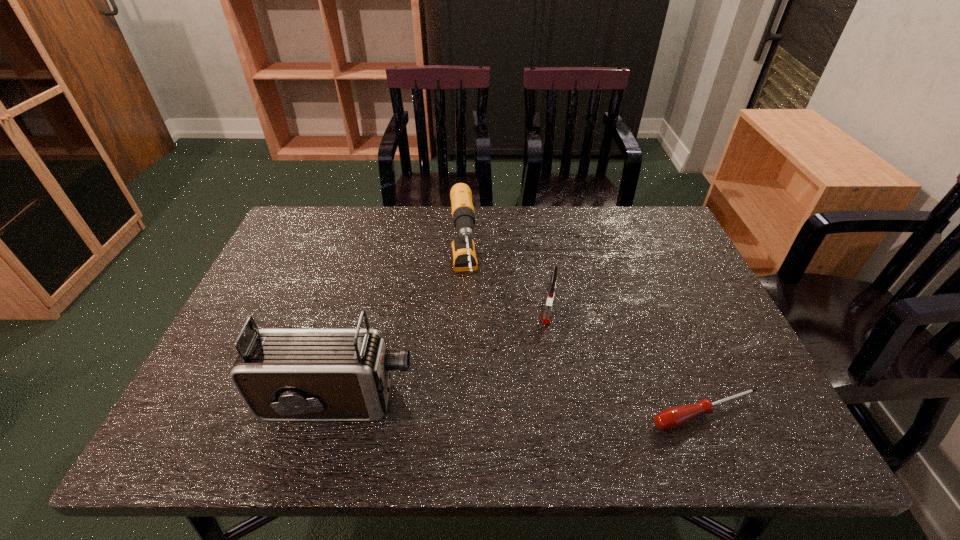
You are a GUI agent. You are given a task and a screenshot of the screen. Output one action in this format:
    pyautogui.click(x=<x>, y=<y>)
    Task: Click on the camcorder
    The image size is (960, 540).
    Given the screenshot: What is the action you would take?
    pyautogui.click(x=282, y=374)

Where is `the rightmost object`? The width and height of the screenshot is (960, 540). the rightmost object is located at coordinates (671, 418).

The height and width of the screenshot is (540, 960). Identify the location of screwdriver. (671, 418).

What are the coordinates of `stapler` in the screenshot? It's located at (549, 302).

Find the location of `the third tallest object`. the third tallest object is located at coordinates (549, 302).

Locate an element on the screen. the third object from right to left is located at coordinates coord(464,255).

The height and width of the screenshot is (540, 960). In order to click on blank space located at the lens of the leftmost object in this screenshot , I will do `click(602, 401)`.

Locate an element on the screen. This screenshot has width=960, height=540. vacant space located on the handle side of the third tallest object is located at coordinates (540, 381).

The height and width of the screenshot is (540, 960). Find the location of `free space located on the handle side of the third tallest object`. free space located on the handle side of the third tallest object is located at coordinates (545, 349).

Locate an element on the screen. This screenshot has width=960, height=540. vacant space situated on the handle side of the third tallest object is located at coordinates (540, 385).